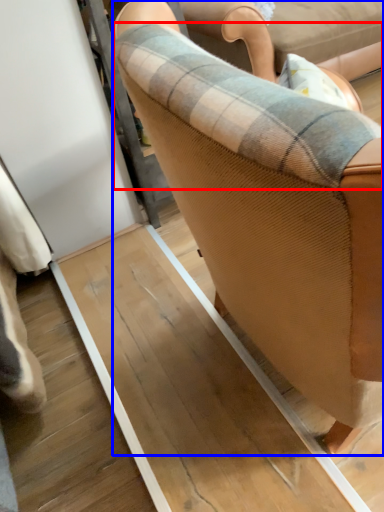
Question: Which point is further to the camera, plaid (highlighted by a red box) or chair (highlighted by a blue box)?

Choices:
 (A) plaid
 (B) chair

Answer: (A)